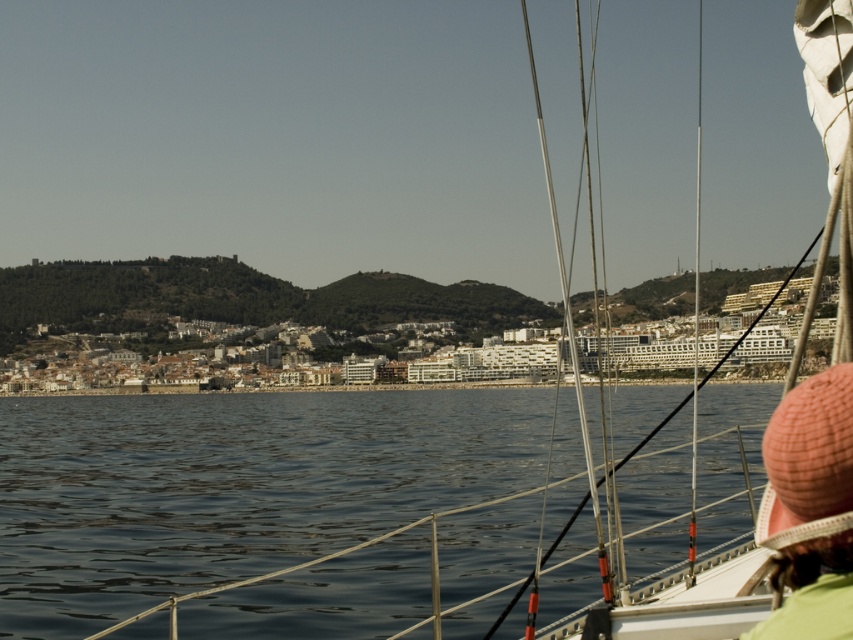
Question: Considering the relative positions of dark blue water at center and metallic silver mast at right in the image provided, where is dark blue water at center located with respect to metallic silver mast at right?

Choices:
 (A) below
 (B) above

Answer: (A)

Question: Which point is closer to the camera?

Choices:
 (A) metallic silver mast at right
 (B) pink knitted hat at lower right
 (C) dark blue water at center

Answer: (B)

Question: Is pink knitted hat at lower right to the right of metallic silver mast at right from the viewer's perspective?

Choices:
 (A) no
 (B) yes

Answer: (A)

Question: Is pink knitted hat at lower right wider than metallic silver mast at right?

Choices:
 (A) no
 (B) yes

Answer: (A)

Question: Which is nearer to the dark blue water at center?

Choices:
 (A) pink knitted hat at lower right
 (B) metallic silver mast at right

Answer: (B)

Question: Which point is farther to the camera?

Choices:
 (A) (206, 433)
 (B) (851, 477)
 (C) (695, 420)

Answer: (A)